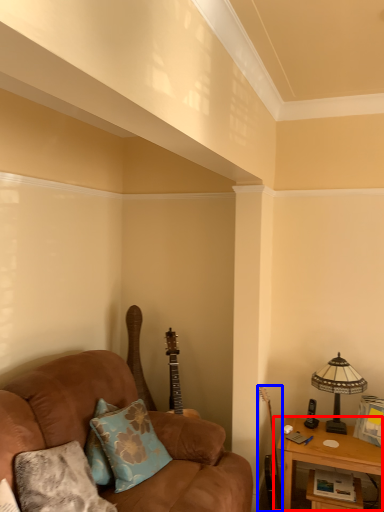
Question: Which of the following is the closest to the observer, table (highlighted by a red box) or guitar (highlighted by a blue box)?

Choices:
 (A) table
 (B) guitar

Answer: (A)